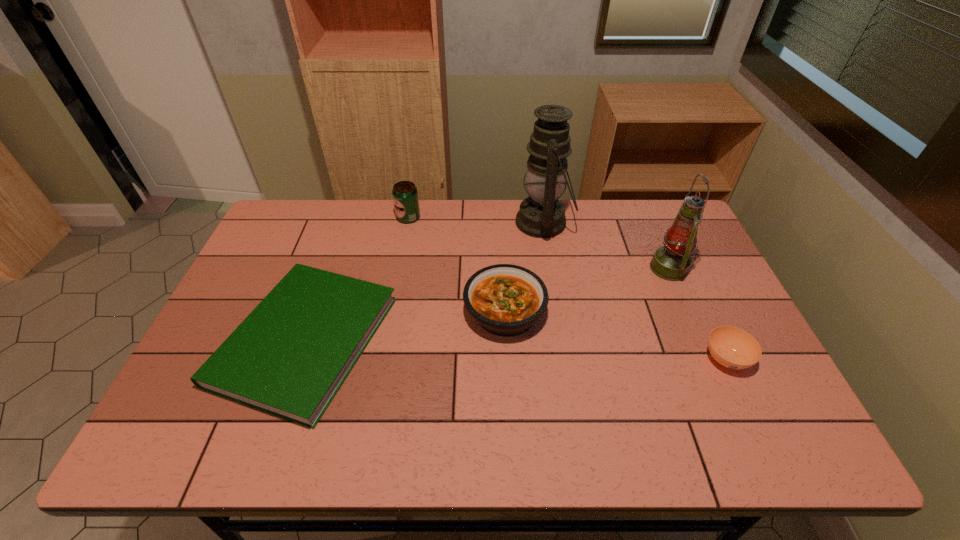
The width and height of the screenshot is (960, 540). Find the location of `vacant space located on the right of the third tallest object`. vacant space located on the right of the third tallest object is located at coordinates (446, 218).

At what (x,y) coordinates should I click in order to perform the action: click on free space located on the left of the stew. Please return your answer as a coordinate pair (x, y). The height and width of the screenshot is (540, 960). Looking at the image, I should click on (388, 313).

Locate an element on the screen. Image resolution: width=960 pixels, height=540 pixels. free space located 0.170m on the back of the second shortest object is located at coordinates (695, 293).

Where is `blank area located 0.270m on the right of the paperback book`? The width and height of the screenshot is (960, 540). blank area located 0.270m on the right of the paperback book is located at coordinates (492, 340).

Identify the location of oil lamp at the far edge. This screenshot has height=540, width=960. (541, 215).

You are a GUI agent. You are given a task and a screenshot of the screen. Output one action in this format:
    pyautogui.click(x=<x>, y=<y>)
    Task: Click on the beer can present at the far edge
    
    Given the screenshot: What is the action you would take?
    pyautogui.click(x=405, y=195)

The image size is (960, 540). Identify the location of object situated at the near edge. (289, 357).

The width and height of the screenshot is (960, 540). I want to click on object that is positioned at the left edge, so click(289, 357).

Identify the location of oil lamp that is at the right edge. (671, 262).

Where is `soup bowl at the right edge`? soup bowl at the right edge is located at coordinates (733, 348).